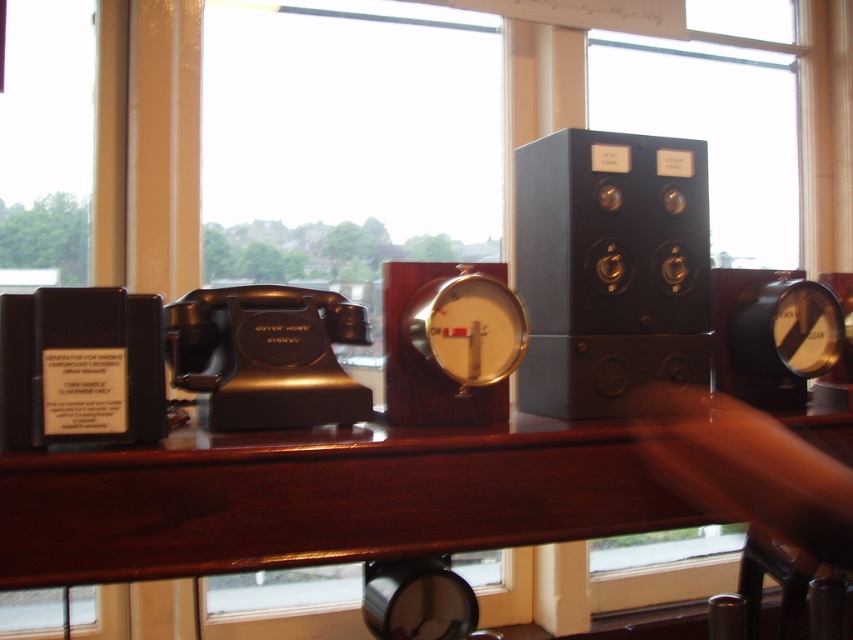
You are a museum curator arranging an exhibit. You need to place a decorative plaque on the desk so that it is visible from above both the mahogany wood table at center and the black matte speaker at center. Where should you position the plaque?

The mahogany wood table at center is below the black matte speaker at center, so positioning the plaque above the black matte speaker at center would allow it to be visible from above both objects.

You are a museum curator arranging an exhibit. You need to place a 15 cm tall artifact on the desk so it sits above both the mahogany wood table at center and the black matte speaker at center. Is this possible?

The mahogany wood table at center has a lesser height compared to black matte speaker at center. Since the speaker is taller than the table, placing a 15 cm tall artifact to be above both would require the artifact to be taller than the speaker. Without knowing the speaker height, it is impossible to determine.

You are a museum curator arranging items on the mahogany wood table at center and the black matte speaker at center. If you want to place a decorative item between them, where should you position it to ensure it fits between their edges?

The mahogany wood table at center is wider than the black matte speaker at center. Therefore, placing the decorative item between the edges of the mahogany wood table at center and the black matte speaker at center would require positioning it closer to the narrower side of the black matte speaker at center to ensure it fits within the available space.